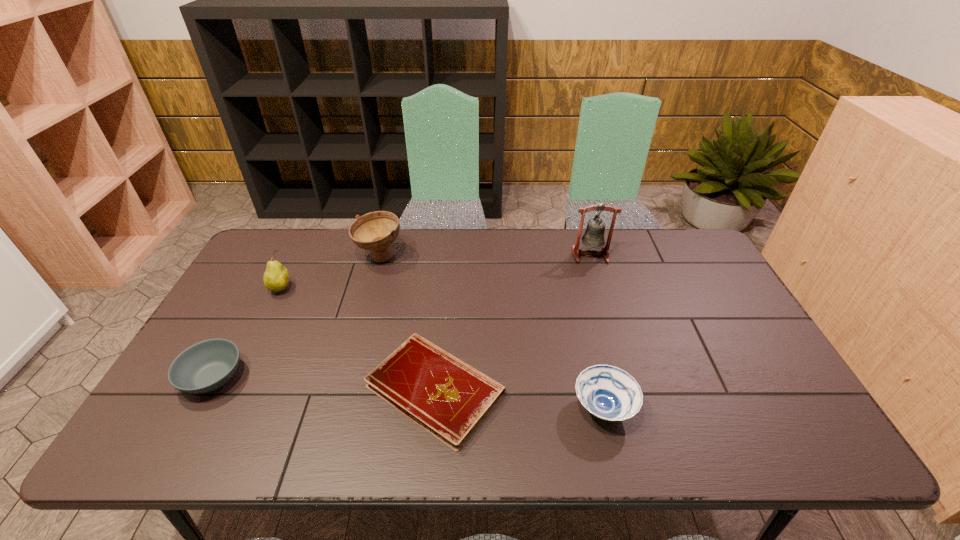
I want to click on free space at the far edge of the desktop, so click(638, 236).

This screenshot has width=960, height=540. I want to click on free spot at the near edge of the desktop, so click(x=230, y=429).

Identify the location of free space at the left edge of the desktop. (271, 320).

This screenshot has width=960, height=540. In order to click on free space at the right edge in this screenshot , I will do `click(732, 324)`.

Locate an element on the screen. vacant area at the near left corner of the desktop is located at coordinates (181, 440).

What are the coordinates of `vacant area at the far right corner` in the screenshot? It's located at (x=693, y=238).

Find the location of `free region at the near right corner of the desktop`. free region at the near right corner of the desktop is located at coordinates (743, 425).

Locate an element on the screen. The width and height of the screenshot is (960, 540). empty space that is in between the pear and the shortest object is located at coordinates (358, 339).

This screenshot has height=540, width=960. In order to click on empty space between the fifth shortest object and the pear in this screenshot , I will do `click(330, 273)`.

Image resolution: width=960 pixels, height=540 pixels. What are the coordinates of `free space between the leftmost soup bowl and the second tallest object` in the screenshot? It's located at (297, 318).